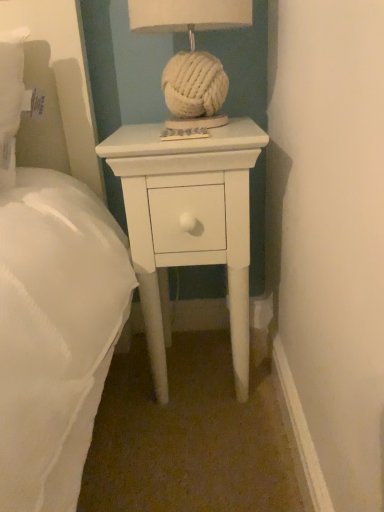
Question: In terms of height, does white matte nightstand at center look taller or shorter compared to white knitted ball at center?

Choices:
 (A) tall
 (B) short

Answer: (A)

Question: Would you say white matte nightstand at center is to the left or to the right of white knitted ball at center in the picture?

Choices:
 (A) right
 (B) left

Answer: (A)

Question: Choose the correct answer: Is white matte nightstand at center inside white knitted ball at center or outside it?

Choices:
 (A) outside
 (B) inside

Answer: (A)

Question: In terms of height, does white knitted ball at center look taller or shorter compared to white matte nightstand at center?

Choices:
 (A) tall
 (B) short

Answer: (B)

Question: In terms of size, does white knitted ball at center appear bigger or smaller than white matte nightstand at center?

Choices:
 (A) small
 (B) big

Answer: (A)

Question: From a real-world perspective, is white knitted ball at center physically located above or below white matte nightstand at center?

Choices:
 (A) below
 (B) above

Answer: (B)

Question: Is white knitted ball at center to the left or to the right of white matte nightstand at center in the image?

Choices:
 (A) right
 (B) left

Answer: (B)